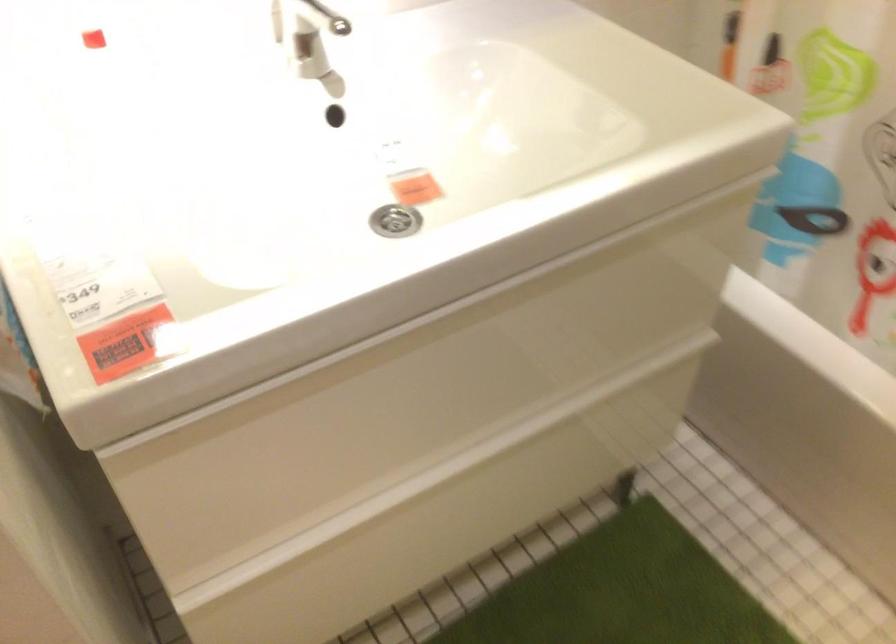
What do you see at coordinates (394, 221) in the screenshot? The height and width of the screenshot is (644, 896). I see `the sink drain stopper` at bounding box center [394, 221].